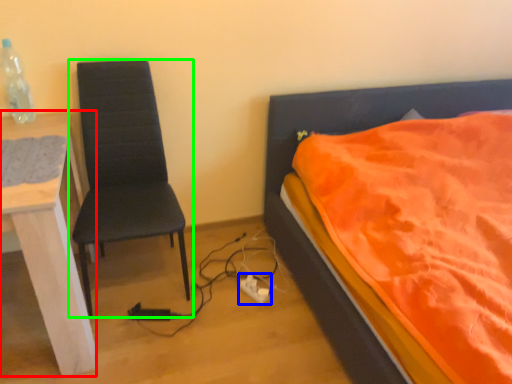
Question: Based on their relative distances, which object is nearer to desk (highlighted by a red box)? Choose from power plugs and sockets (highlighted by a blue box) and chair (highlighted by a green box).

Choices:
 (A) power plugs and sockets
 (B) chair

Answer: (B)